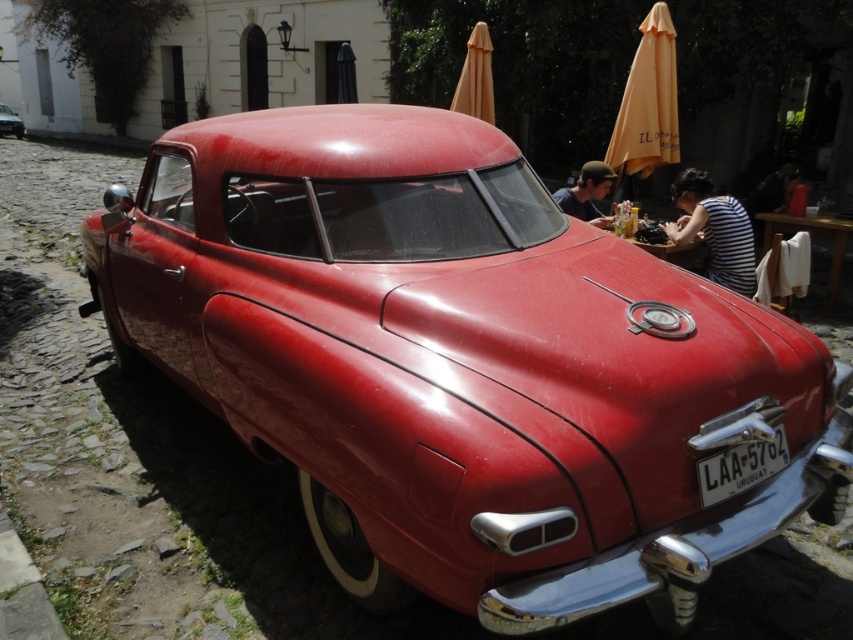
Who is lower down, metallic silver license plate at lower center or smooth black shirt at upper right?

metallic silver license plate at lower center is lower down.

Is point (755, 465) more distant than point (793, 184)?

No, it is not.

This screenshot has width=853, height=640. I want to click on metallic silver license plate at lower center, so click(x=740, y=467).

The width and height of the screenshot is (853, 640). Describe the element at coordinates (587, 193) in the screenshot. I see `matte black hair at upper center` at that location.

You are a GUI agent. You are given a task and a screenshot of the screen. Output one action in this format:
    pyautogui.click(x=<x>, y=<y>)
    Task: Click on the matte black hair at upper center
    The width and height of the screenshot is (853, 640).
    Given the screenshot: What is the action you would take?
    pyautogui.click(x=587, y=193)

Find the location of a particular element. The image size is (853, 640). matte black hair at upper center is located at coordinates (587, 193).

Can you confirm if metallic silver license plate at lower center is positioned to the left of shiny red car at center?

No, metallic silver license plate at lower center is not to the left of shiny red car at center.

Is metallic silver license plate at lower center in front of shiny red car at center?

Yes, metallic silver license plate at lower center is closer to the viewer.

The height and width of the screenshot is (640, 853). I want to click on metallic silver license plate at lower center, so 740,467.